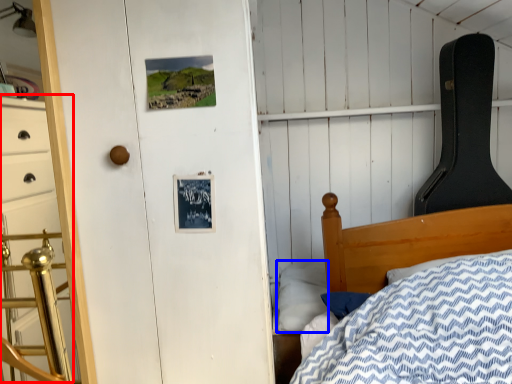
Question: Which object appears farthest to the camera in this image, dresser (highlighted by a red box) or pillow (highlighted by a blue box)?

Choices:
 (A) dresser
 (B) pillow

Answer: (B)